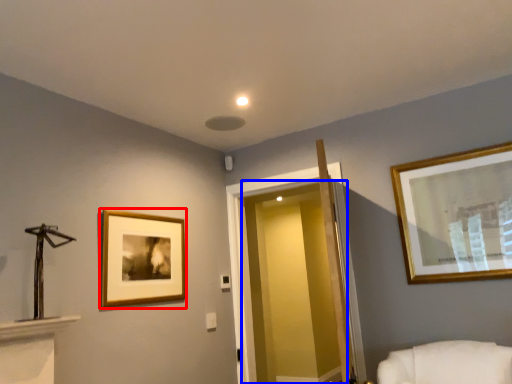
Question: Which object appears closest to the camera in this image, picture frame (highlighted by a red box) or glass door (highlighted by a blue box)?

Choices:
 (A) picture frame
 (B) glass door

Answer: (A)